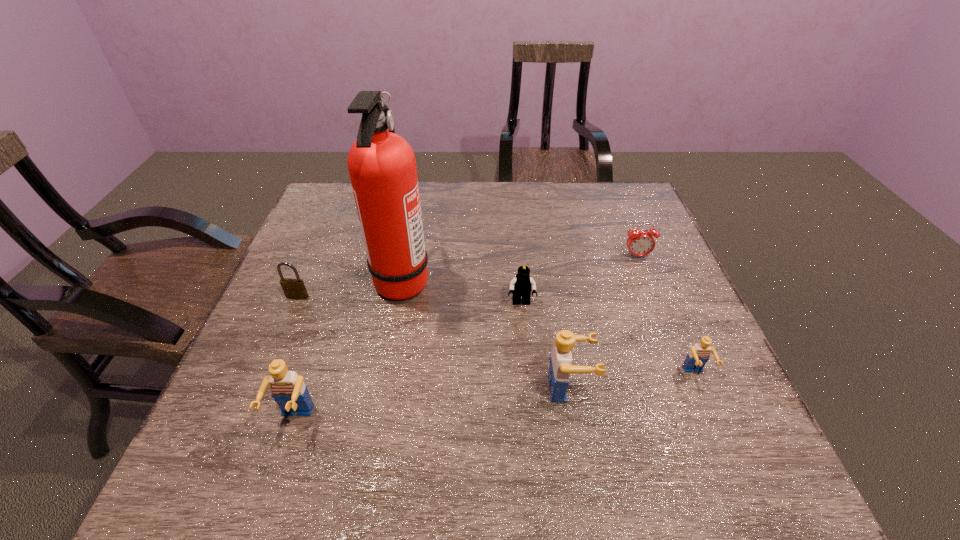
In order to click on vacant space positioned 0.230m on the face of the second Lego from right to left in this screenshot , I will do `click(703, 388)`.

At what (x,y) coordinates should I click in order to perform the action: click on free region located on the front of the padlock. Please return your answer as a coordinate pair (x, y). This screenshot has height=540, width=960. Looking at the image, I should click on (268, 366).

The image size is (960, 540). I want to click on free point located on the face of the alarm clock, so click(x=672, y=345).

Identify the location of blank space located on the front-facing side of the fourth object from right to left. click(x=530, y=396).

In order to click on blank space located 0.370m on the handle side of the third object from left to right in this screenshot , I will do `click(573, 280)`.

Where is `Lego present at the left edge`? This screenshot has height=540, width=960. Lego present at the left edge is located at coordinates (287, 388).

The height and width of the screenshot is (540, 960). I want to click on padlock at the left edge, so click(293, 288).

Locate an element on the screen. The image size is (960, 540). Lego situated at the right edge is located at coordinates (698, 356).

Where is `alarm clock that is positioned at the right edge`? This screenshot has height=540, width=960. alarm clock that is positioned at the right edge is located at coordinates (640, 243).

You are a GUI agent. You are given a task and a screenshot of the screen. Output one action in this format:
    pyautogui.click(x=<x>, y=<y>)
    Task: Click on the object located in the near left corner section of the desktop
    
    Given the screenshot: What is the action you would take?
    287,388